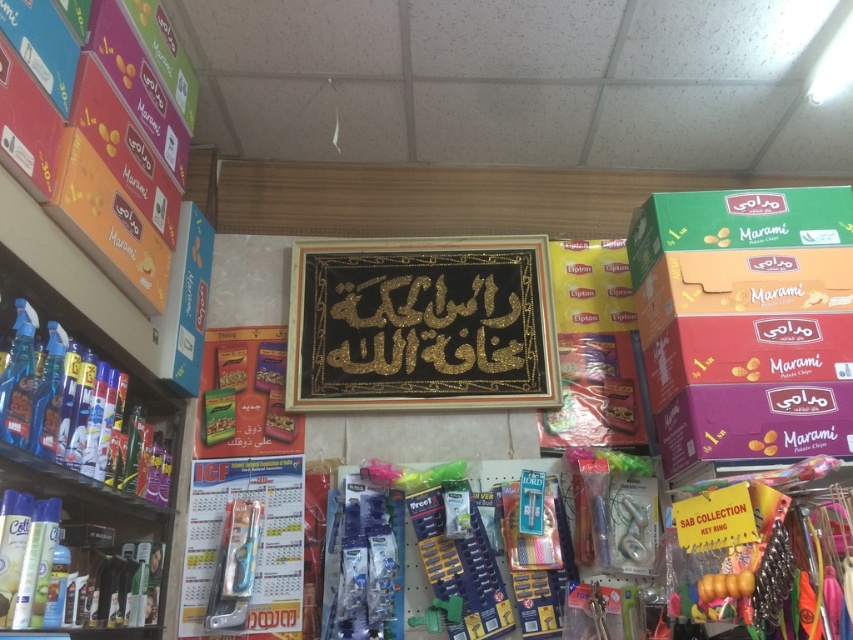
You are an employee restocking shelves in the shop. You need to place a new item that is 10 cm tall. The green matte box at right and the shiny plastic bottles at left are already on the shelves. Which object can accommodate the new item if placed on top without exceeding its height?

The green matte box at right has a lesser height compared to shiny plastic bottles at left, so placing the new item on top of the green matte box at right would be safer to avoid exceeding its height.

You are a customer in the shop and want to grab the green matte box at right and the gold glitter calligraphy at center. Which one is easier to reach without moving your current position?

The green matte box at right is closer to the viewer than the gold glitter calligraphy at center, so it is easier to reach without moving.

You are a customer in the shop and want to reach the orange matte box at upper left and the shiny plastic bottles at left. Which item is easier to reach if you are of average height?

The orange matte box at upper left is shorter than the shiny plastic bottles at left, so it would be easier to reach since it is lower.